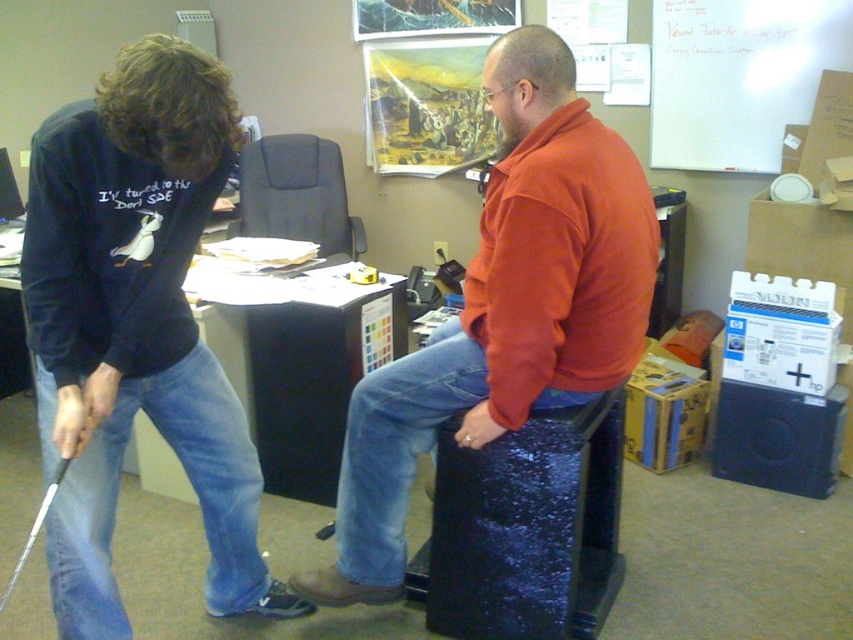
Question: Observing the image, what is the correct spatial positioning of matte black golf club at left in reference to white glossy golf club at lower left?

Choices:
 (A) right
 (B) left

Answer: (A)

Question: Does denim at left have a lesser width compared to white glossy golf club at lower left?

Choices:
 (A) no
 (B) yes

Answer: (A)

Question: Which point appears closest to the camera in this image?

Choices:
 (A) (54, 492)
 (B) (567, 81)

Answer: (A)

Question: Which of the following is the farthest from the observer?

Choices:
 (A) (183, 122)
 (B) (62, 472)
 (C) (780, 90)
 (D) (509, 424)

Answer: (C)

Question: Among these objects, which one is nearest to the camera?

Choices:
 (A) denim at left
 (B) shiny blue stool at center

Answer: (A)

Question: Can you confirm if matte black golf club at left is smaller than blue denim jeans at center?

Choices:
 (A) yes
 (B) no

Answer: (B)